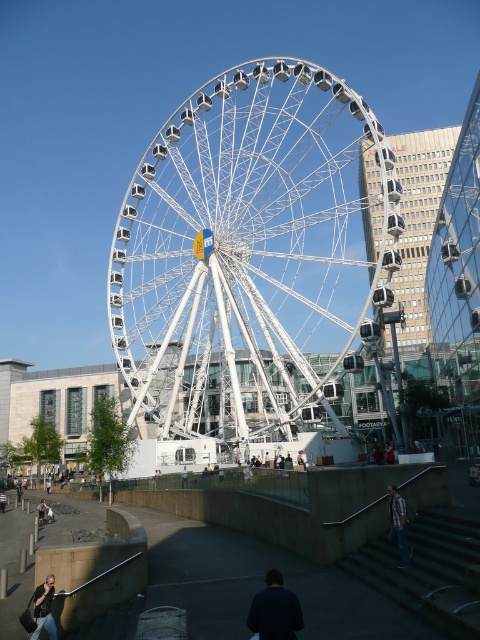
Between point (300, 332) and point (35, 618), which one is positioned behind?

Point (300, 332)

Is white metallic ferris wheel at center to the left of leather jacket at lower left from the viewer's perspective?

No, white metallic ferris wheel at center is not to the left of leather jacket at lower left.

At what (x,y) coordinates should I click in order to perform the action: click on white metallic ferris wheel at center. Please return your answer as a coordinate pair (x, y). Image resolution: width=480 pixels, height=640 pixels. Looking at the image, I should click on (252, 259).

The height and width of the screenshot is (640, 480). I want to click on white metallic ferris wheel at center, so click(x=252, y=259).

How much distance is there between dark blue jacket at lower center and plaid shirt at lower right?

dark blue jacket at lower center is 12.29 meters away from plaid shirt at lower right.

Is point (297, 605) more distant than point (402, 518)?

That is False.

Measure the distance between dark blue jacket at lower center and camera.

dark blue jacket at lower center and camera are 127.42 feet apart from each other.

The height and width of the screenshot is (640, 480). Identify the location of dark blue jacket at lower center. (275, 611).

Is light brown leather jacket at center above light brown wooden bench at center?

Yes, light brown leather jacket at center is above light brown wooden bench at center.

How much distance is there between light brown leather jacket at center and light brown wooden bench at center?

13.45 meters

Is point (305, 456) positioned after point (184, 470)?

No, (305, 456) is in front of (184, 470).

Where is `light brown leather jacket at center`? The image size is (480, 640). light brown leather jacket at center is located at coordinates (301, 458).